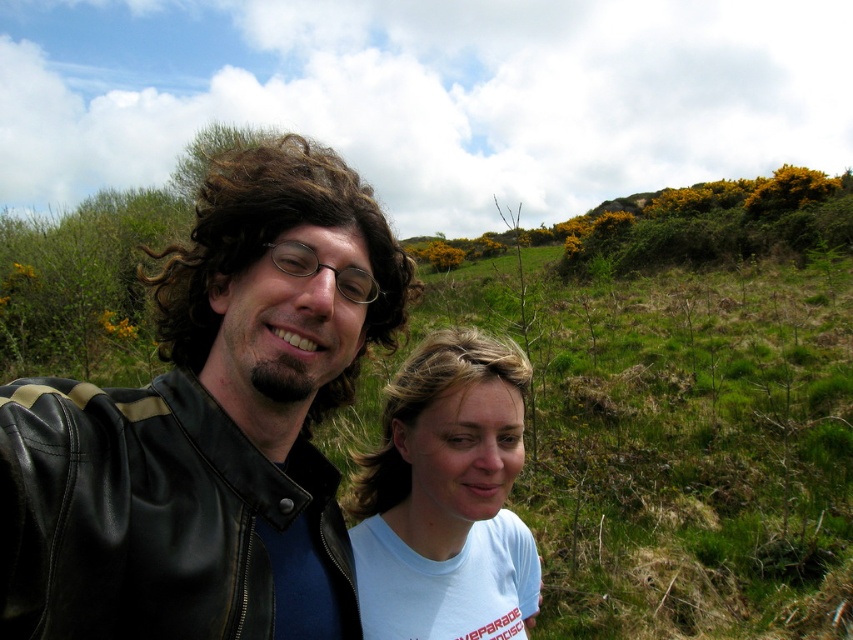
Which of these two, black leather jacket at center or light blue t-shirt at center, stands taller?

black leather jacket at center

How much distance is there between black leather jacket at center and light blue t-shirt at center?

black leather jacket at center is 21.97 inches away from light blue t-shirt at center.

Is point (265, 593) positioned after point (498, 432)?

No, (265, 593) is in front of (498, 432).

The image size is (853, 640). What are the coordinates of `black leather jacket at center` in the screenshot? It's located at (209, 428).

Who is taller, green grassy hillside at upper center or light blue t-shirt at center?

Standing taller between the two is green grassy hillside at upper center.

You are a GUI agent. You are given a task and a screenshot of the screen. Output one action in this format:
    pyautogui.click(x=<x>, y=<y>)
    Task: Click on the green grassy hillside at upper center
    
    Given the screenshot: What is the action you would take?
    pyautogui.click(x=679, y=442)

Where is `green grassy hillside at upper center`? The height and width of the screenshot is (640, 853). green grassy hillside at upper center is located at coordinates (679, 442).

Measure the distance between black leather jacket at center and green grassy hillside at upper center.

They are 27.84 feet apart.

Who is shorter, black leather jacket at center or green grassy hillside at upper center?

black leather jacket at center

Locate an element on the screen. The image size is (853, 640). black leather jacket at center is located at coordinates (209, 428).